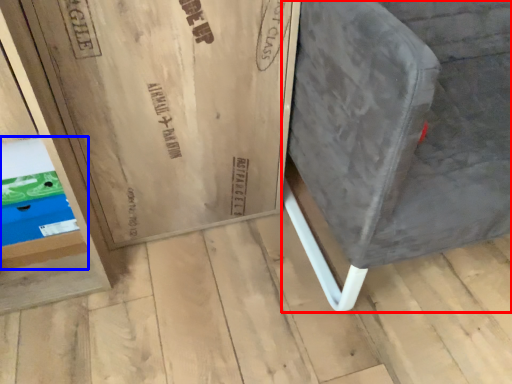
Question: Which point is closer to the camera, furniture (highlighted by a red box) or shelf (highlighted by a blue box)?

Choices:
 (A) furniture
 (B) shelf

Answer: (A)